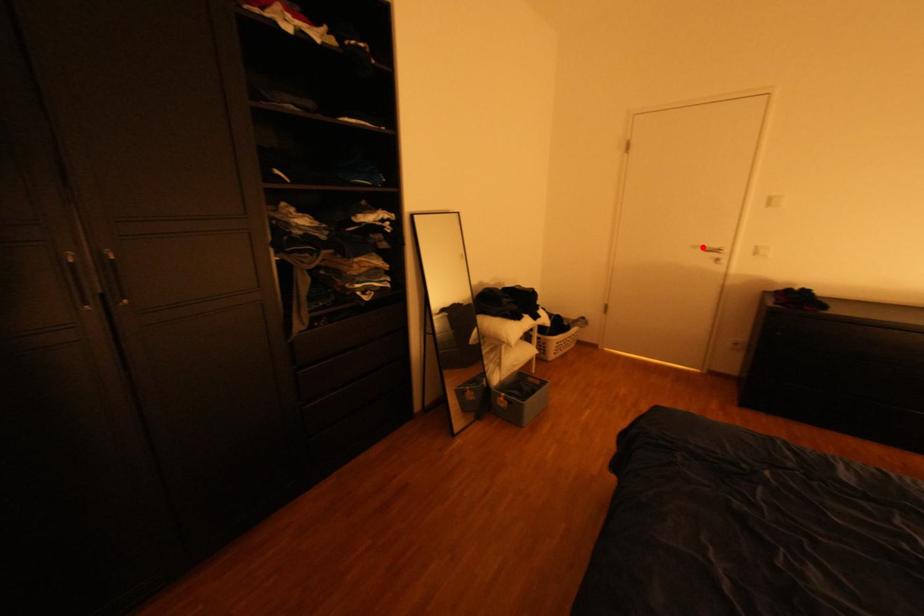
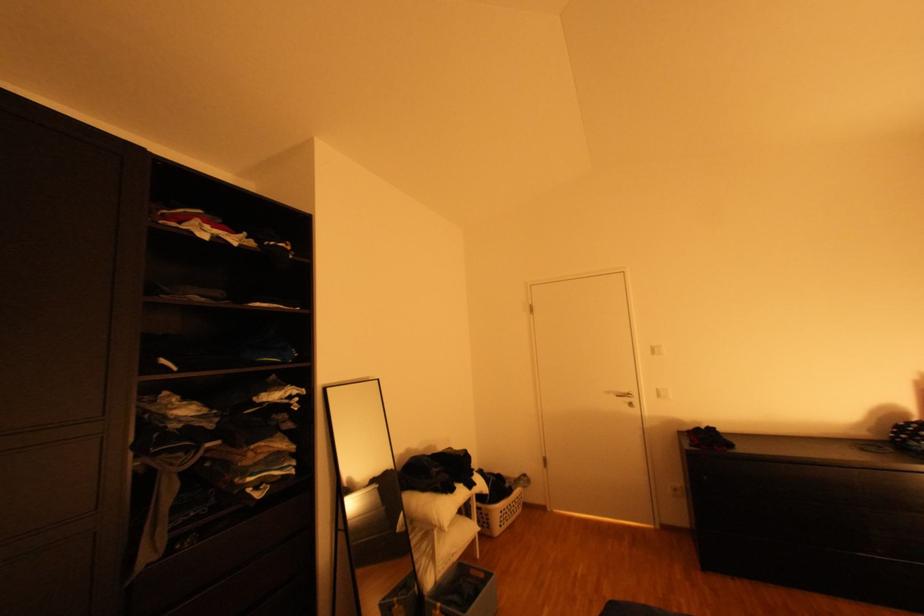
In the second image, find the point that corresponds to the highlighted location in the first image.

(617, 392)